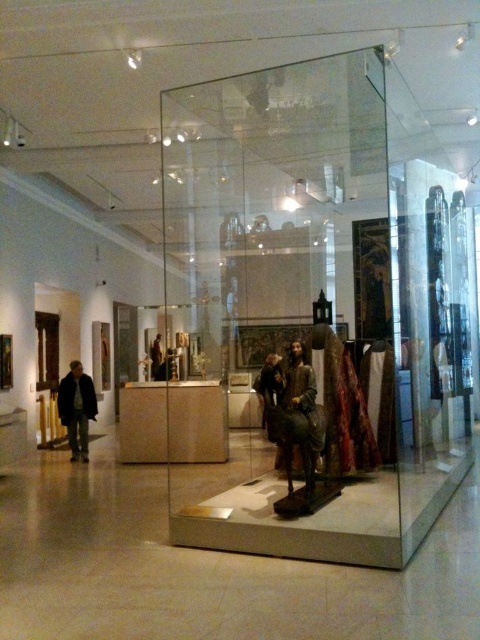
Is transparent glass box at center to the left of dark brown leather jacket at center from the viewer's perspective?

Incorrect, transparent glass box at center is not on the left side of dark brown leather jacket at center.

Does transparent glass box at center have a lesser width compared to dark brown leather jacket at center?

Incorrect, transparent glass box at center's width is not less than dark brown leather jacket at center's.

Where is `transparent glass box at center`? transparent glass box at center is located at coordinates (319, 301).

At what (x,y) coordinates should I click in order to perform the action: click on transparent glass box at center. Please return your answer as a coordinate pair (x, y). Looking at the image, I should click on (319, 301).

Is smooth brown statue at center wider than dark brown leather jacket at lower left?

In fact, smooth brown statue at center might be narrower than dark brown leather jacket at lower left.

How far apart are smooth brown statue at center and dark brown leather jacket at lower left?

The distance of smooth brown statue at center from dark brown leather jacket at lower left is 5.27 meters.

Is point (296, 394) behind point (70, 426)?

No.

The height and width of the screenshot is (640, 480). I want to click on smooth brown statue at center, so click(296, 408).

Can you confirm if dark brown leather jacket at lower left is positioned to the left of dark brown leather jacket at center?

Indeed, dark brown leather jacket at lower left is positioned on the left side of dark brown leather jacket at center.

Does dark brown leather jacket at lower left have a larger size compared to dark brown leather jacket at center?

No.

Is point (59, 394) farther from camera compared to point (260, 392)?

No, it is in front of (260, 392).

Where is `dark brown leather jacket at lower left`? dark brown leather jacket at lower left is located at coordinates (76, 408).